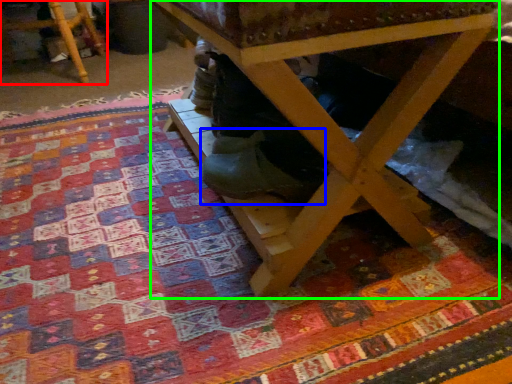
Question: Considering the real-world distances, which object is closest to furniture (highlighted by a red box)? shoe (highlighted by a blue box) or table (highlighted by a green box).

Choices:
 (A) shoe
 (B) table

Answer: (A)